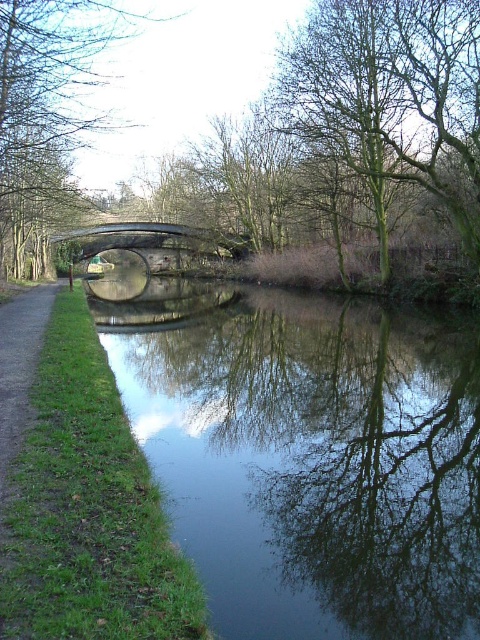
Question: Does green leafy tree at upper center lie behind metallic gray bridge at center?

Choices:
 (A) yes
 (B) no

Answer: (B)

Question: Considering the relative positions of green leafy tree at left and metallic gray bridge at center in the image provided, where is green leafy tree at left located with respect to metallic gray bridge at center?

Choices:
 (A) right
 (B) left

Answer: (B)

Question: Is green leafy tree at upper center smaller than metallic gray bridge at center?

Choices:
 (A) yes
 (B) no

Answer: (B)

Question: Which of the following is the farthest from the observer?

Choices:
 (A) (363, 420)
 (B) (23, 164)
 (C) (339, 96)

Answer: (C)

Question: Which point is farther from the camera taking this photo?

Choices:
 (A) (57, 120)
 (B) (394, 152)

Answer: (B)

Question: Which is nearer to the metallic gray bridge at center?

Choices:
 (A) green leafy tree at left
 (B) clear glass water at center
 (C) green leafy tree at upper center

Answer: (A)